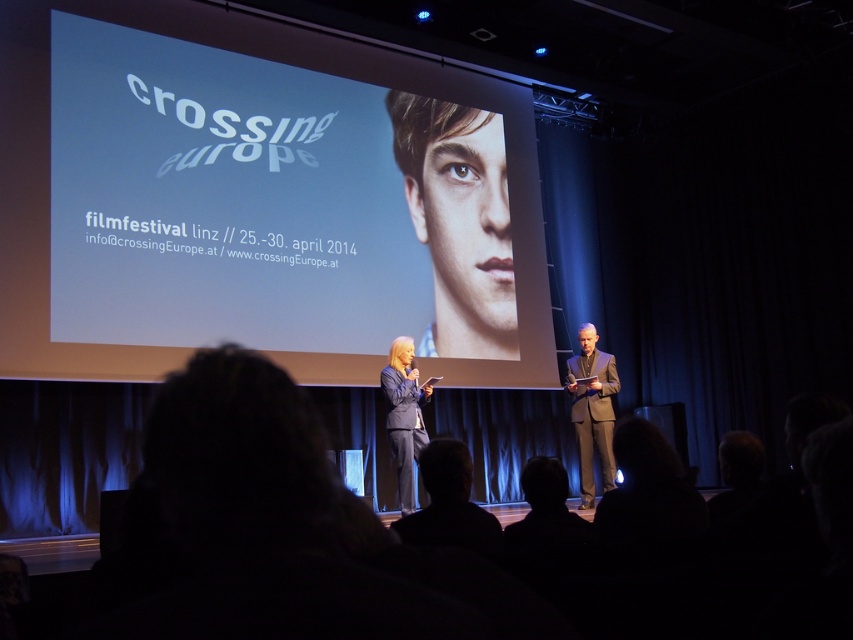
Does white glossy screen at upper center have a greater width compared to matte black suit at center?

Indeed, white glossy screen at upper center has a greater width compared to matte black suit at center.

Which is in front, point (515, 380) or point (389, 349)?

Point (389, 349) is more forward.

What are the coordinates of `white glossy screen at upper center` in the screenshot? It's located at (258, 200).

Which of these two, smooth skin portrait at center or matte black suit at center, stands shorter?

Standing shorter between the two is matte black suit at center.

Who is lower down, smooth skin portrait at center or matte black suit at center?

matte black suit at center

Is point (425, 237) closer to viewer compared to point (402, 493)?

That is False.

The image size is (853, 640). What are the coordinates of `smooth skin portrait at center` in the screenshot? It's located at (459, 220).

Is point (354, 257) behind point (611, 477)?

Yes, point (354, 257) is farther from viewer.

Can you confirm if white glossy screen at upper center is positioned below dark gray suit at right?

No.

The width and height of the screenshot is (853, 640). What do you see at coordinates (258, 200) in the screenshot?
I see `white glossy screen at upper center` at bounding box center [258, 200].

At what (x,y) coordinates should I click in order to perform the action: click on white glossy screen at upper center. Please return your answer as a coordinate pair (x, y). Image resolution: width=853 pixels, height=640 pixels. Looking at the image, I should click on (258, 200).